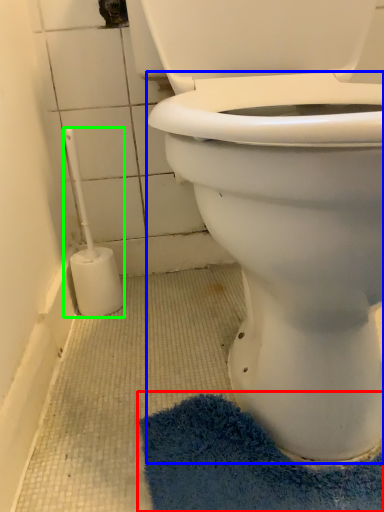
Question: Based on their relative distances, which object is nearer to bath mat (highlighted by a red box)? Choose from bidet (highlighted by a blue box) and brush (highlighted by a green box).

Choices:
 (A) bidet
 (B) brush

Answer: (A)